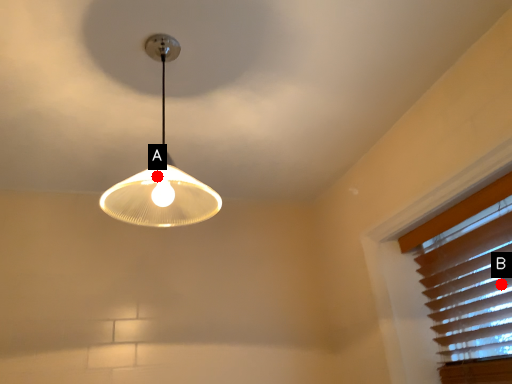
Question: Two points are circled on the image, labeled by A and B beside each circle. Which point is farther from the camera taking this photo?

Choices:
 (A) A is further
 (B) B is further

Answer: (B)